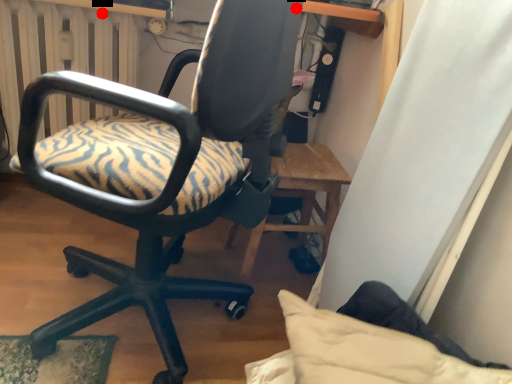
Question: Two points are circled on the image, labeled by A and B beside each circle. Among these points, which one is farthest from the camera?

Choices:
 (A) A is further
 (B) B is further

Answer: (B)